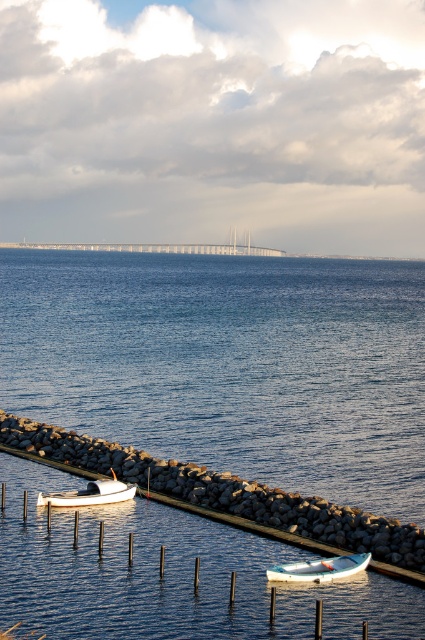
Does gray rock wall at lower left appear under white matte boat at lower left?

Incorrect, gray rock wall at lower left is not positioned below white matte boat at lower left.

Does point (243, 516) lie in front of point (71, 493)?

Yes, point (243, 516) is closer to viewer.

Image resolution: width=425 pixels, height=640 pixels. Find the location of `gray rock wall at lower left`. gray rock wall at lower left is located at coordinates (224, 492).

Is blue water at center below white matte boat at lower center?

Incorrect, blue water at center is not positioned below white matte boat at lower center.

In the scene shown: Who is more forward, [309,440] or [312,579]?

Positioned in front is point [312,579].

Image resolution: width=425 pixels, height=640 pixels. In order to click on blue water at center in this screenshot , I will do `click(229, 364)`.

Which of these two, white matte boat at lower center or white matte boat at lower left, stands taller?

Standing taller between the two is white matte boat at lower left.

Between point (331, 563) and point (121, 486), which one is positioned behind?

The point (121, 486) is more distant.

Where is `white matte boat at lower center`? Image resolution: width=425 pixels, height=640 pixels. white matte boat at lower center is located at coordinates (320, 568).